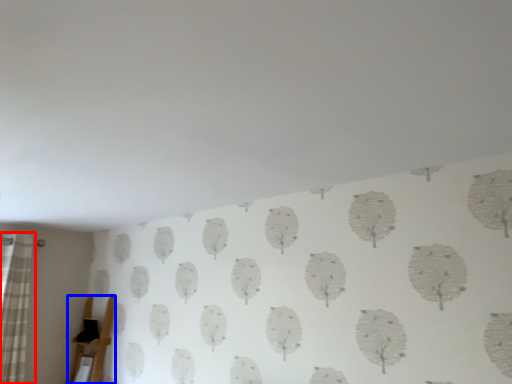
Question: Which object appears closest to the camera in this image, curtain (highlighted by a red box) or furniture (highlighted by a blue box)?

Choices:
 (A) curtain
 (B) furniture

Answer: (A)